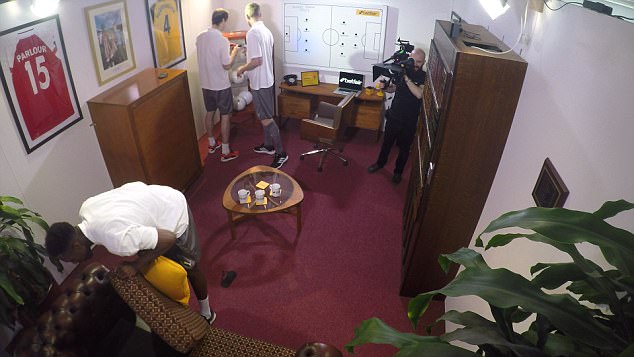
The height and width of the screenshot is (357, 634). I want to click on desk, so click(319, 91).